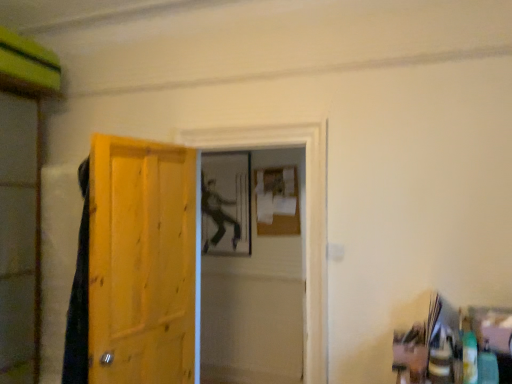
I want to click on wooden door at left, so click(x=141, y=262).

Where is `matte wooden screen door at center, which is the 1th screen door from right to left`? matte wooden screen door at center, which is the 1th screen door from right to left is located at coordinates (251, 281).

Locate an element on the screen. The image size is (512, 384). wooden door at left is located at coordinates (141, 262).

Looking at this image, is matte black figure at center far from transparent plastic screen door at left, placed as the 2th screen door when sorted from right to left?

Yes, matte black figure at center is far from transparent plastic screen door at left, placed as the 2th screen door when sorted from right to left.

Who is shorter, matte black figure at center or transparent plastic screen door at left, placed as the 2th screen door when sorted from right to left?

matte black figure at center is shorter.

Does matte black figure at center have a larger size compared to transparent plastic screen door at left, placed as the 2th screen door when sorted from right to left?

No, matte black figure at center is not bigger than transparent plastic screen door at left, placed as the 2th screen door when sorted from right to left.

The image size is (512, 384). In order to click on door that appears below the matte wooden screen door at center, marked as the second screen door in a left-to-right arrangement (from a real-world perspective) in this screenshot , I will do `click(141, 262)`.

Is wooden door at left oriented away from matte wooden screen door at center, marked as the second screen door in a left-to-right arrangement?

No.

Considering the relative sizes of wooden door at left and matte wooden screen door at center, marked as the second screen door in a left-to-right arrangement, in the image provided, is wooden door at left smaller than matte wooden screen door at center, marked as the second screen door in a left-to-right arrangement,?

Indeed, wooden door at left has a smaller size compared to matte wooden screen door at center, marked as the second screen door in a left-to-right arrangement.

From the image's perspective, between wooden door at left and matte wooden screen door at center, marked as the second screen door in a left-to-right arrangement, who is located below?

From the image's view, wooden door at left is below.

Does point (34, 151) lie behind point (195, 258)?

Yes, point (34, 151) is behind point (195, 258).

Is transparent plastic screen door at left, placed as the 2th screen door when sorted from right to left, aimed at wooden door at left?

Yes, transparent plastic screen door at left, placed as the 2th screen door when sorted from right to left, is oriented towards wooden door at left.

Considering the sizes of objects transparent plastic screen door at left, positioned as the 1th screen door in left-to-right order, and wooden door at left in the image provided, who is bigger, transparent plastic screen door at left, positioned as the 1th screen door in left-to-right order, or wooden door at left?

Bigger between the two is transparent plastic screen door at left, positioned as the 1th screen door in left-to-right order.

Does point (265, 276) appear closer or farther from the camera than point (17, 291)?

Point (265, 276).

Measure the distance from matte wooden screen door at center, which is the 1th screen door from right to left, to transparent plastic screen door at left, placed as the 2th screen door when sorted from right to left.

A distance of 5.53 feet exists between matte wooden screen door at center, which is the 1th screen door from right to left, and transparent plastic screen door at left, placed as the 2th screen door when sorted from right to left.

Between matte wooden screen door at center, marked as the second screen door in a left-to-right arrangement, and transparent plastic screen door at left, placed as the 2th screen door when sorted from right to left, which one has less height?

Standing shorter between the two is matte wooden screen door at center, marked as the second screen door in a left-to-right arrangement.

Between matte wooden screen door at center, which is the 1th screen door from right to left, and transparent plastic screen door at left, placed as the 2th screen door when sorted from right to left, which one has smaller width?

matte wooden screen door at center, which is the 1th screen door from right to left, is thinner.

Considering the relative positions of matte black figure at center and matte wooden screen door at center, which is the 1th screen door from right to left, in the image provided, is matte black figure at center to the right of matte wooden screen door at center, which is the 1th screen door from right to left, from the viewer's perspective?

Incorrect, matte black figure at center is not on the right side of matte wooden screen door at center, which is the 1th screen door from right to left.

Measure the distance from matte black figure at center to matte wooden screen door at center, marked as the second screen door in a left-to-right arrangement.

matte black figure at center and matte wooden screen door at center, marked as the second screen door in a left-to-right arrangement, are 41.72 centimeters apart.

Looking at this image, from a real-world perspective, is matte black figure at center above or below matte wooden screen door at center, marked as the second screen door in a left-to-right arrangement?

matte black figure at center is situated higher than matte wooden screen door at center, marked as the second screen door in a left-to-right arrangement, in the real world.

Which object is thinner, matte black figure at center or matte wooden screen door at center, which is the 1th screen door from right to left?

matte black figure at center.

Can you see matte black figure at center touching wooden door at left?

matte black figure at center and wooden door at left are clearly separated.

Who is bigger, matte black figure at center or wooden door at left?

Bigger between the two is wooden door at left.

From the image's perspective, is matte black figure at center under wooden door at left?

Actually, matte black figure at center appears above wooden door at left in the image.

Which of these two, matte black figure at center or wooden door at left, stands shorter?

Standing shorter between the two is matte black figure at center.

From a real-world perspective, does wooden door at left stand above transparent plastic screen door at left, positioned as the 1th screen door in left-to-right order?

Incorrect, from a real-world perspective, wooden door at left is lower than transparent plastic screen door at left, positioned as the 1th screen door in left-to-right order.

Is wooden door at left positioned far away from transparent plastic screen door at left, placed as the 2th screen door when sorted from right to left?

wooden door at left is near transparent plastic screen door at left, placed as the 2th screen door when sorted from right to left, not far away.

Consider the image. Could you tell me if wooden door at left is facing transparent plastic screen door at left, positioned as the 1th screen door in left-to-right order?

No.

Identify the location of person behind the transparent plastic screen door at left, positioned as the 1th screen door in left-to-right order. (217, 214).

Where is `door below the matte wooden screen door at center, marked as the second screen door in a left-to-right arrangement (from the image's perspective)`? The height and width of the screenshot is (384, 512). door below the matte wooden screen door at center, marked as the second screen door in a left-to-right arrangement (from the image's perspective) is located at coordinates (141, 262).

From the image, which object appears to be farther from wooden door at left, transparent plastic screen door at left, positioned as the 1th screen door in left-to-right order, or matte black figure at center?

matte black figure at center is further to wooden door at left.

From the image, which object appears to be nearer to matte wooden screen door at center, marked as the second screen door in a left-to-right arrangement, wooden door at left or transparent plastic screen door at left, placed as the 2th screen door when sorted from right to left?

wooden door at left is positioned closer to the anchor matte wooden screen door at center, marked as the second screen door in a left-to-right arrangement.

Estimate the real-world distances between objects in this image. Which object is closer to matte black figure at center, matte wooden screen door at center, which is the 1th screen door from right to left, or transparent plastic screen door at left, positioned as the 1th screen door in left-to-right order?

The object closer to matte black figure at center is matte wooden screen door at center, which is the 1th screen door from right to left.

Which object lies nearer to the anchor point matte black figure at center, transparent plastic screen door at left, placed as the 2th screen door when sorted from right to left, or wooden door at left?

Among the two, wooden door at left is located nearer to matte black figure at center.

In the scene shown: Looking at the image, which one is located further to matte black figure at center, wooden door at left or transparent plastic screen door at left, positioned as the 1th screen door in left-to-right order?

The object further to matte black figure at center is transparent plastic screen door at left, positioned as the 1th screen door in left-to-right order.

Considering their positions, is wooden door at left positioned further to matte wooden screen door at center, which is the 1th screen door from right to left, than matte black figure at center?

wooden door at left lies further to matte wooden screen door at center, which is the 1th screen door from right to left, than the other object.

Considering their positions, is transparent plastic screen door at left, positioned as the 1th screen door in left-to-right order, positioned further to matte black figure at center than matte wooden screen door at center, marked as the second screen door in a left-to-right arrangement?

The object further to matte black figure at center is transparent plastic screen door at left, positioned as the 1th screen door in left-to-right order.

Estimate the real-world distances between objects in this image. Which object is closer to transparent plastic screen door at left, positioned as the 1th screen door in left-to-right order, wooden door at left or matte black figure at center?

Among the two, wooden door at left is located nearer to transparent plastic screen door at left, positioned as the 1th screen door in left-to-right order.

Where is `door located between transparent plastic screen door at left, placed as the 2th screen door when sorted from right to left, and matte wooden screen door at center, which is the 1th screen door from right to left, in the left-right direction`? This screenshot has height=384, width=512. door located between transparent plastic screen door at left, placed as the 2th screen door when sorted from right to left, and matte wooden screen door at center, which is the 1th screen door from right to left, in the left-right direction is located at coordinates (141, 262).

Where is `person between transparent plastic screen door at left, positioned as the 1th screen door in left-to-right order, and matte wooden screen door at center, marked as the second screen door in a left-to-right arrangement, from left to right`? This screenshot has height=384, width=512. person between transparent plastic screen door at left, positioned as the 1th screen door in left-to-right order, and matte wooden screen door at center, marked as the second screen door in a left-to-right arrangement, from left to right is located at coordinates (217, 214).